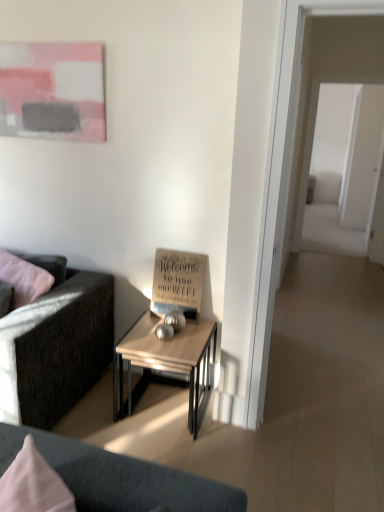
Question: Are wooden table at center and transparent glass door at right beside each other?

Choices:
 (A) no
 (B) yes

Answer: (A)

Question: Is wooden table at center far away from transparent glass door at right?

Choices:
 (A) no
 (B) yes

Answer: (B)

Question: Is wooden table at center bigger than transparent glass door at right?

Choices:
 (A) no
 (B) yes

Answer: (A)

Question: Does wooden table at center contain transparent glass door at right?

Choices:
 (A) yes
 (B) no

Answer: (B)

Question: Does wooden table at center have a lesser height compared to transparent glass door at right?

Choices:
 (A) no
 (B) yes

Answer: (B)

Question: Does wooden table at center appear on the right side of transparent glass door at right?

Choices:
 (A) yes
 (B) no

Answer: (B)

Question: From the image's perspective, is wooden sign at center over transparent glass door at right?

Choices:
 (A) no
 (B) yes

Answer: (A)

Question: Can you confirm if wooden sign at center is smaller than transparent glass door at right?

Choices:
 (A) no
 (B) yes

Answer: (B)

Question: Does wooden sign at center have a lesser width compared to transparent glass door at right?

Choices:
 (A) yes
 (B) no

Answer: (A)

Question: Is wooden sign at center located outside transparent glass door at right?

Choices:
 (A) yes
 (B) no

Answer: (A)

Question: Is wooden sign at center surrounding transparent glass door at right?

Choices:
 (A) no
 (B) yes

Answer: (A)

Question: Can you confirm if wooden sign at center is positioned to the right of transparent glass door at right?

Choices:
 (A) no
 (B) yes

Answer: (A)

Question: Does dark gray fabric couch at left lie in front of matte pink painting at upper left?

Choices:
 (A) no
 (B) yes

Answer: (B)